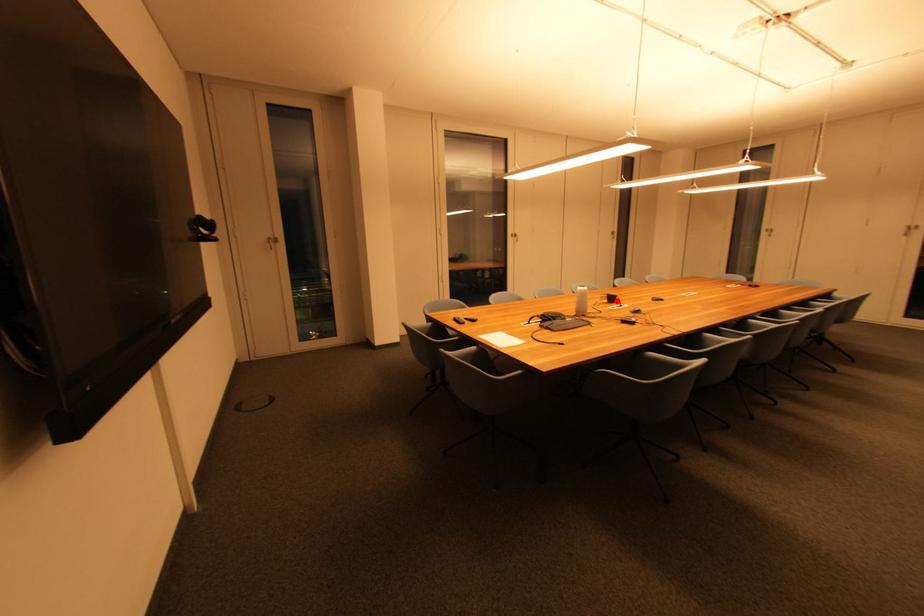
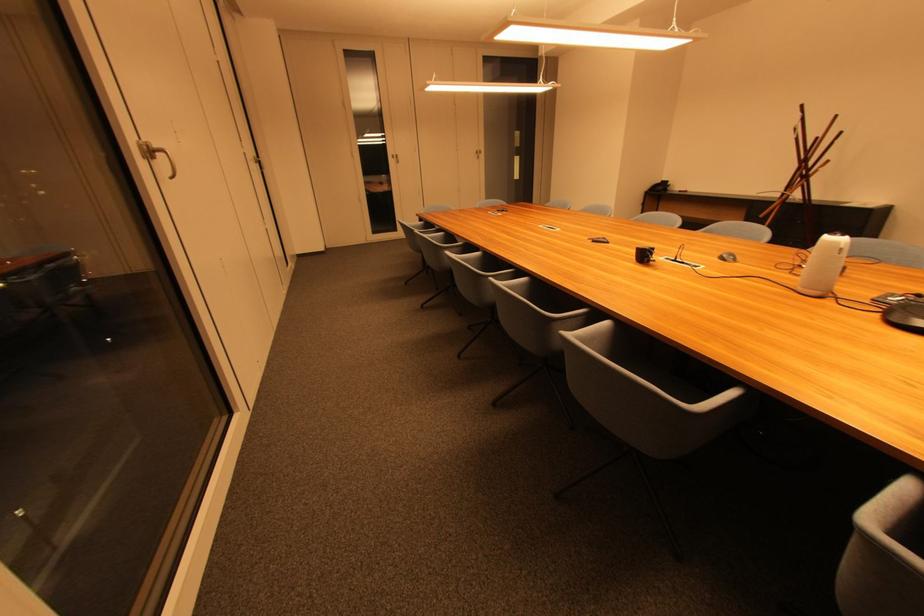
Question: I am providing you with two images of the same scene from different viewpoints. In image1, a red point is highlighted. Considering the same 3D point in image2, which of the following is correct?

Choices:
 (A) It is closer
 (B) It is farther

Answer: (A)